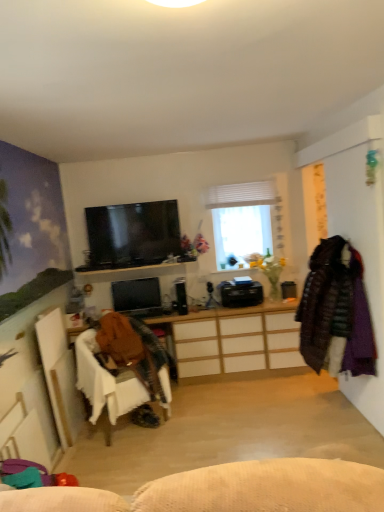
I want to click on free region under dark brown quilted coat at right, marked as the first clothing in a right-to-left arrangement (from a real-world perspective), so click(x=331, y=411).